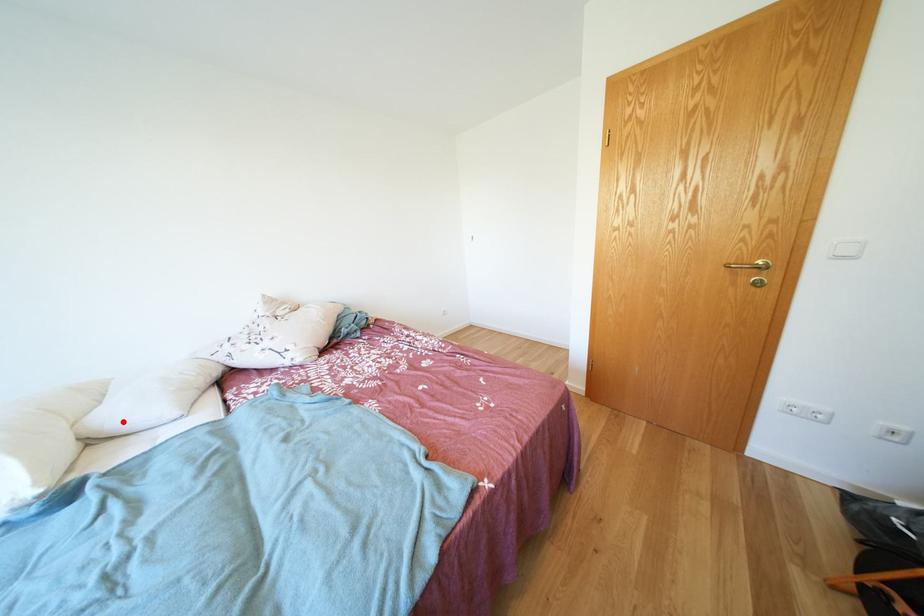
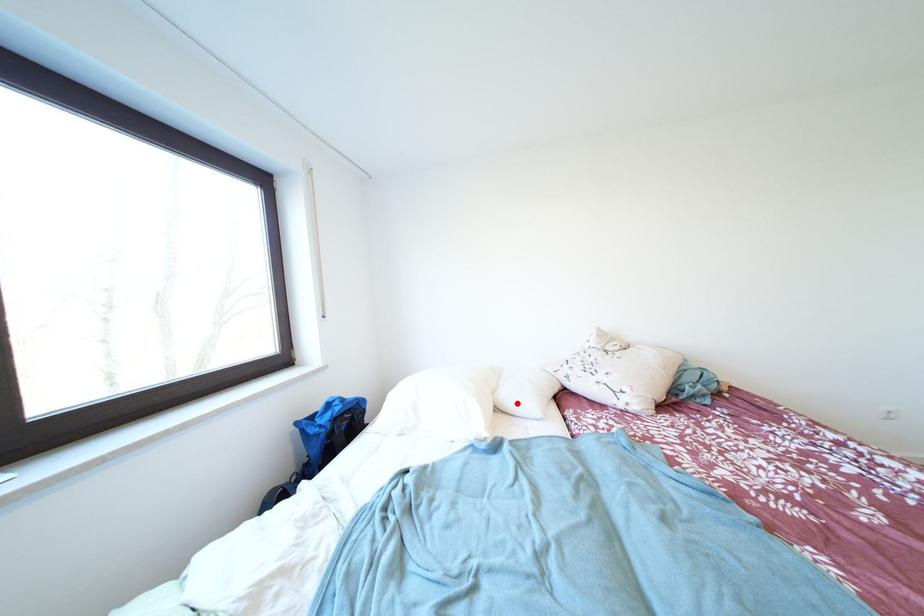
I am providing you with two images of the same scene from different viewpoints. A red point is marked on the first image and another point is marked on the second image. Is the red point in image1 aligned with the point shown in image2?

Yes